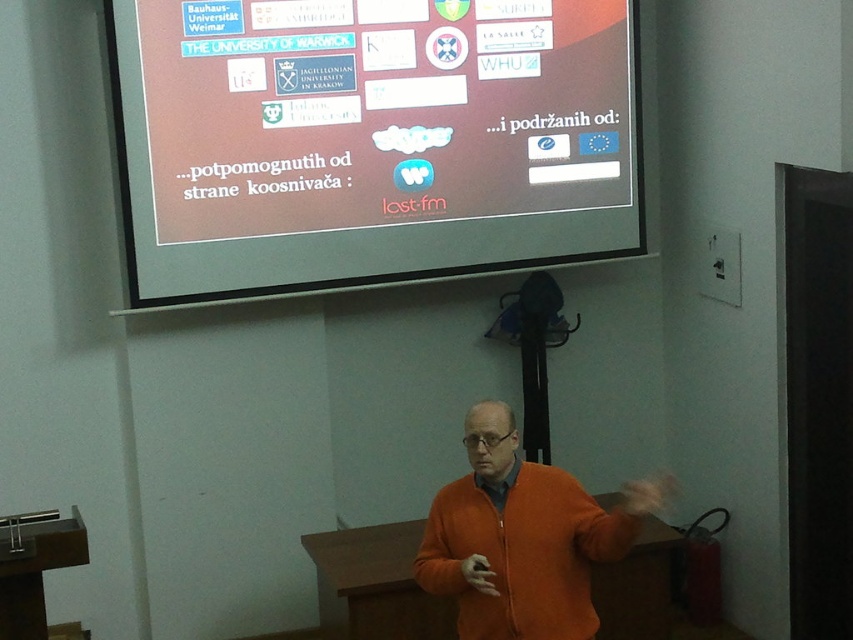
Who is higher up, matte plastic projection screen at upper center or orange zip-up sweater at center?

matte plastic projection screen at upper center

Does matte plastic projection screen at upper center have a greater height compared to orange zip-up sweater at center?

Yes, matte plastic projection screen at upper center is taller than orange zip-up sweater at center.

The image size is (853, 640). Describe the element at coordinates (370, 140) in the screenshot. I see `matte plastic projection screen at upper center` at that location.

The image size is (853, 640). In order to click on matte plastic projection screen at upper center in this screenshot , I will do `click(370, 140)`.